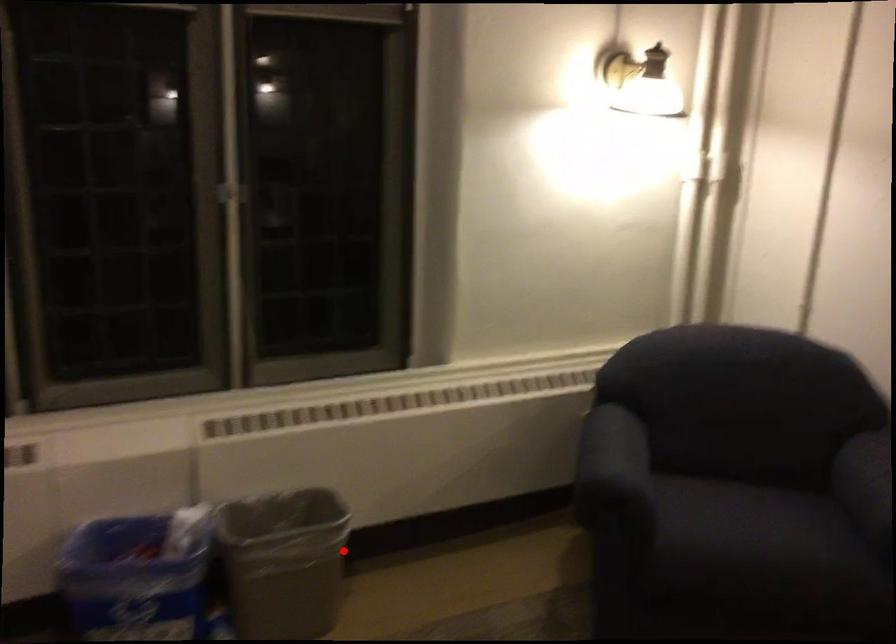
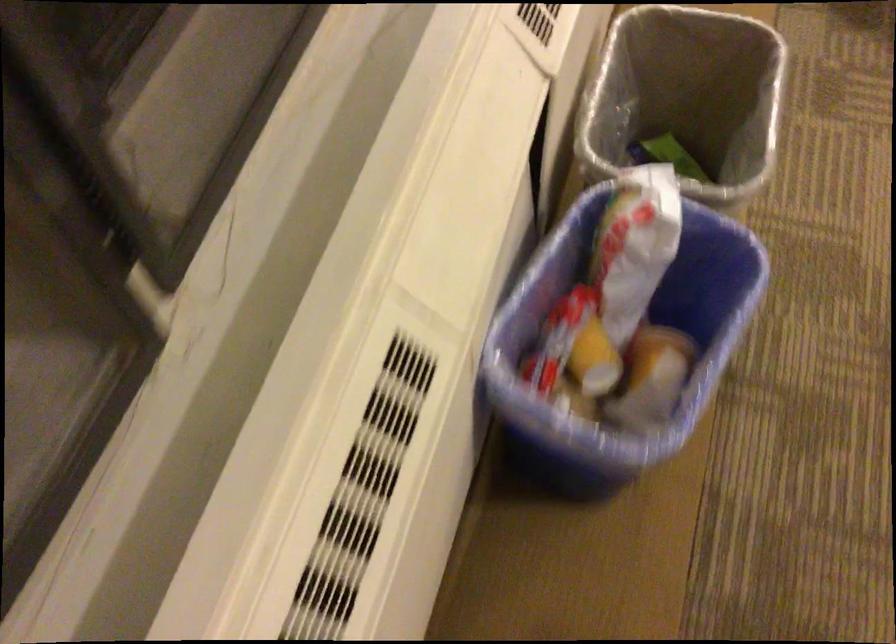
Question: I am providing you with two images of the same scene from different viewpoints. Given a red point in image1, look at the same physical point in image2. Is it:

Choices:
 (A) Closer to the viewpoint
 (B) Farther from the viewpoint

Answer: (A)